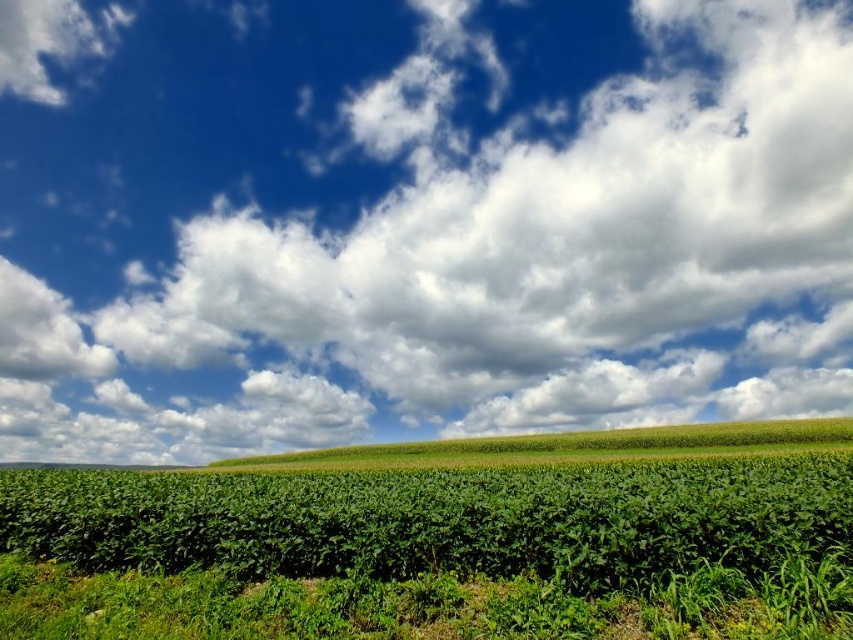
Based on the scene description, where is the white fluffy cloud at upper center located in the image?

The white fluffy cloud at upper center is located at point coordinates of 0.345 on the x axis and 0.489 on the y axis.

You are a farmer standing in the middle of your field looking at the white fluffy cloud at upper center and the green leafy corn at center. Which object is higher in the sky?

The white fluffy cloud at upper center is higher in the sky than the green leafy corn at center because it is positioned above it.